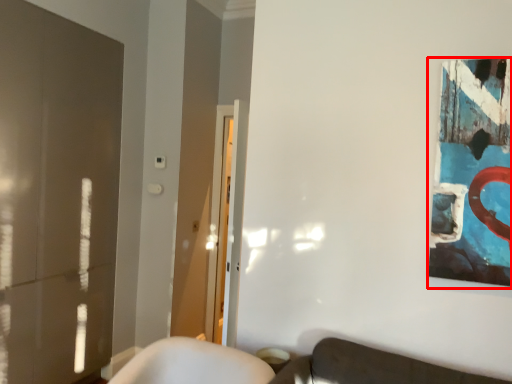
Question: In this image, where is picture frame (annotated by the red box) located relative to glass door?

Choices:
 (A) left
 (B) right

Answer: (B)